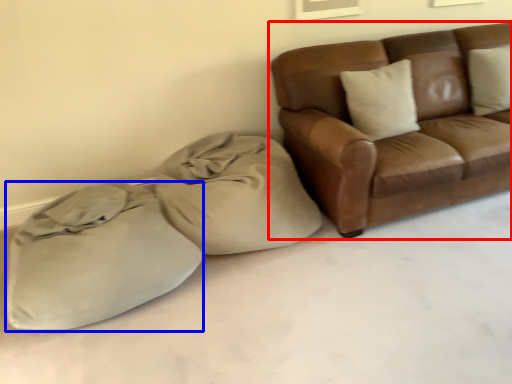
Question: Which of the following is the closest to the observer, studio couch (highlighted by a red box) or sack (highlighted by a blue box)?

Choices:
 (A) studio couch
 (B) sack

Answer: (B)